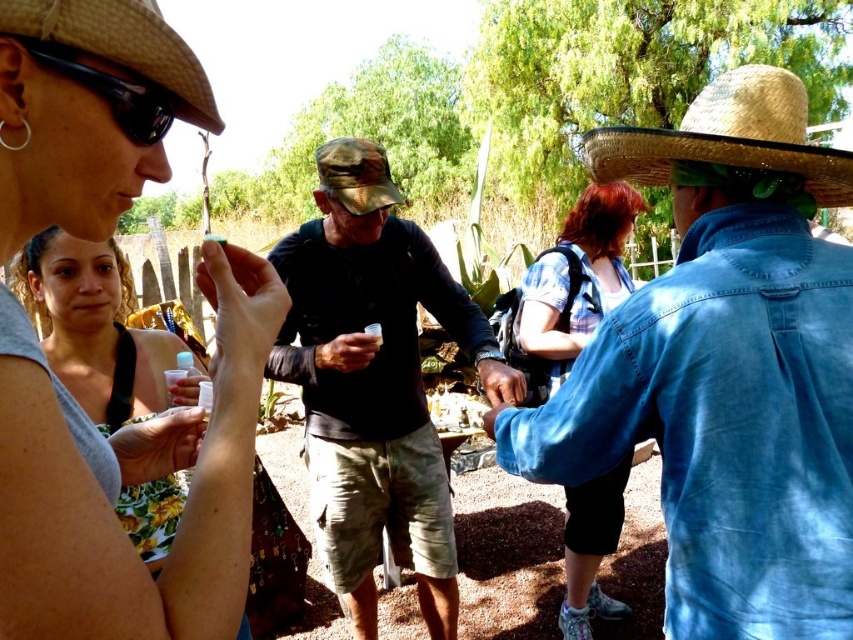
Can you confirm if denim jacket at upper right is positioned above straw hat at upper right?

Actually, denim jacket at upper right is below straw hat at upper right.

Does denim jacket at upper right have a smaller size compared to straw hat at upper right?

No, denim jacket at upper right is not smaller than straw hat at upper right.

Does point (674, 561) come behind point (727, 108)?

Yes, point (674, 561) is farther from viewer.

This screenshot has width=853, height=640. In order to click on denim jacket at upper right in this screenshot , I will do `click(724, 369)`.

Is point (39, 316) closer to viewer compared to point (141, 45)?

That is False.

In the scene shown: Does floral print dress at center have a larger size compared to straw hat at upper left?

Yes.

Is point (103, 304) behind point (190, 56)?

Yes, it is behind point (190, 56).

This screenshot has width=853, height=640. What are the coordinates of `floral print dress at center` in the screenshot? It's located at (97, 330).

Locate an element on the screen. Image resolution: width=853 pixels, height=640 pixels. straw hat at upper left is located at coordinates (120, 44).

Is straw hat at upper left wider than camouflage fabric bucket hat at center?

No.

What do you see at coordinates (120, 44) in the screenshot?
I see `straw hat at upper left` at bounding box center [120, 44].

The image size is (853, 640). Find the location of `straw hat at upper left`. straw hat at upper left is located at coordinates (120, 44).